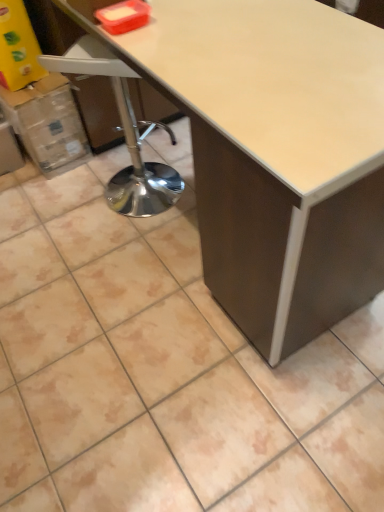
Question: Would you say cardboard box at left is a long distance from white plastic swivel chair at left?

Choices:
 (A) no
 (B) yes

Answer: (A)

Question: Is white plastic swivel chair at left completely or partially inside cardboard box at left?

Choices:
 (A) yes
 (B) no

Answer: (B)

Question: Is cardboard box at left thinner than white plastic swivel chair at left?

Choices:
 (A) yes
 (B) no

Answer: (B)

Question: Could you tell me if cardboard box at left is facing white plastic swivel chair at left?

Choices:
 (A) no
 (B) yes

Answer: (B)

Question: Considering the relative sizes of cardboard box at left and white plastic swivel chair at left in the image provided, is cardboard box at left bigger than white plastic swivel chair at left?

Choices:
 (A) no
 (B) yes

Answer: (A)

Question: Considering the relative sizes of cardboard box at left and white plastic swivel chair at left in the image provided, is cardboard box at left wider than white plastic swivel chair at left?

Choices:
 (A) yes
 (B) no

Answer: (A)

Question: Is white plastic swivel chair at left to the left of matte white table at center from the viewer's perspective?

Choices:
 (A) no
 (B) yes

Answer: (B)

Question: Is white plastic swivel chair at left positioned far away from matte white table at center?

Choices:
 (A) yes
 (B) no

Answer: (B)

Question: Is white plastic swivel chair at left taller than matte white table at center?

Choices:
 (A) no
 (B) yes

Answer: (A)

Question: Can you see white plastic swivel chair at left touching matte white table at center?

Choices:
 (A) no
 (B) yes

Answer: (A)

Question: Considering the relative sizes of white plastic swivel chair at left and matte white table at center in the image provided, is white plastic swivel chair at left wider than matte white table at center?

Choices:
 (A) no
 (B) yes

Answer: (A)

Question: Is white plastic swivel chair at left at the right side of matte white table at center?

Choices:
 (A) no
 (B) yes

Answer: (A)

Question: Considering the relative positions of matte white table at center and cardboard box at left in the image provided, is matte white table at center to the right of cardboard box at left from the viewer's perspective?

Choices:
 (A) no
 (B) yes

Answer: (B)